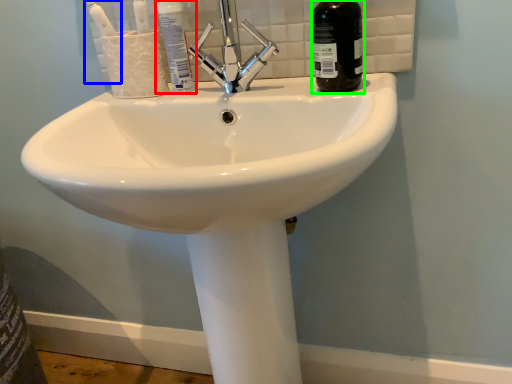
Question: Which object is positioned farthest from mouthwash (highlighted by a red box)? Select from toothbrush (highlighted by a blue box) and bottle (highlighted by a green box).

Choices:
 (A) toothbrush
 (B) bottle

Answer: (B)